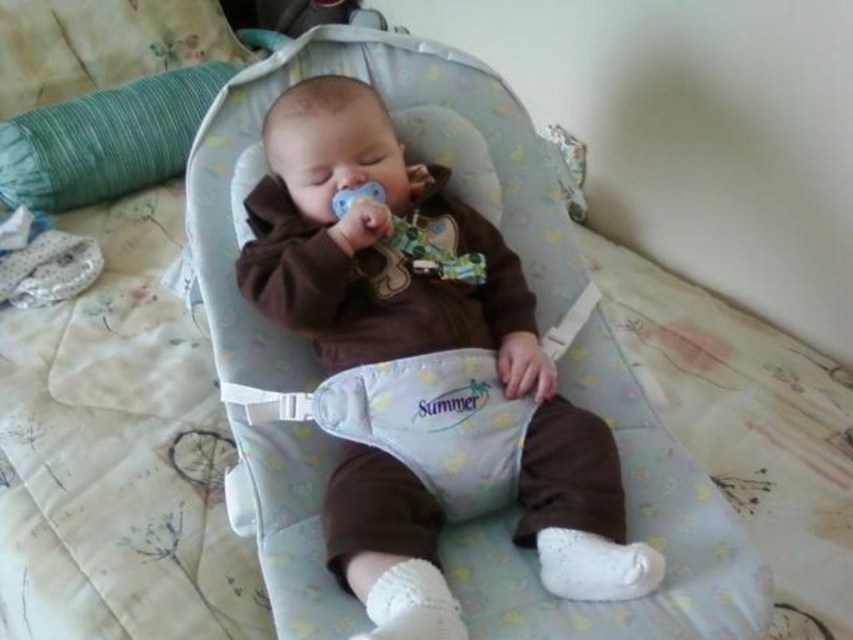
Question: Is matte brown baby at center below green fabric pillow at upper left?

Choices:
 (A) no
 (B) yes

Answer: (B)

Question: Is matte brown baby at center closer to camera compared to green fabric pillow at upper left?

Choices:
 (A) yes
 (B) no

Answer: (A)

Question: Among these points, which one is farthest from the camera?

Choices:
 (A) (421, 516)
 (B) (126, 116)

Answer: (B)

Question: Is the position of matte brown baby at center less distant than that of green fabric pillow at upper left?

Choices:
 (A) no
 (B) yes

Answer: (B)

Question: Which object appears farthest from the camera in this image?

Choices:
 (A) green fabric pillow at upper left
 (B) matte brown baby at center

Answer: (A)